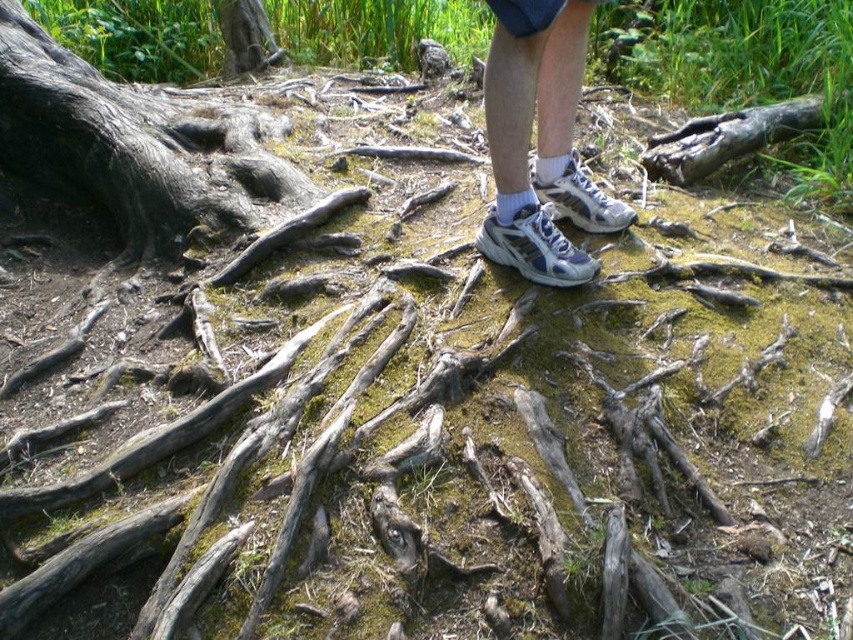
Which of these two, dark gray rough bark at left or white mesh sneakers at center, stands taller?

dark gray rough bark at left is taller.

Is point (119, 131) more distant than point (621, 227)?

Yes.

Find the location of a particular element. Image resolution: width=853 pixels, height=640 pixels. dark gray rough bark at left is located at coordinates (132, 145).